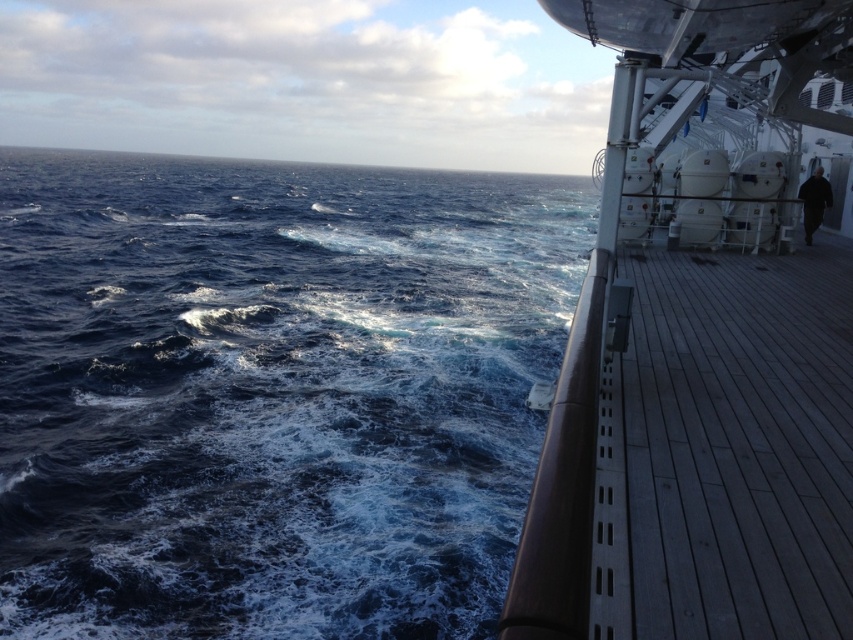
Question: Can you confirm if dark blue water at left is smaller than wooden at right?

Choices:
 (A) yes
 (B) no

Answer: (B)

Question: Which point is closer to the camera?

Choices:
 (A) (637, 205)
 (B) (784, 614)
 (C) (433, 557)

Answer: (B)

Question: Can you confirm if dark blue water at left is positioned to the left of wooden deck at right?

Choices:
 (A) no
 (B) yes

Answer: (B)

Question: Does dark blue water at left appear under wooden at right?

Choices:
 (A) no
 (B) yes

Answer: (A)

Question: Which point appears closest to the camera in this image?

Choices:
 (A) (761, 602)
 (B) (460, 499)
 (C) (631, 401)

Answer: (A)

Question: Which point is farther to the camera?

Choices:
 (A) dark blue water at left
 (B) wooden deck at right

Answer: (A)